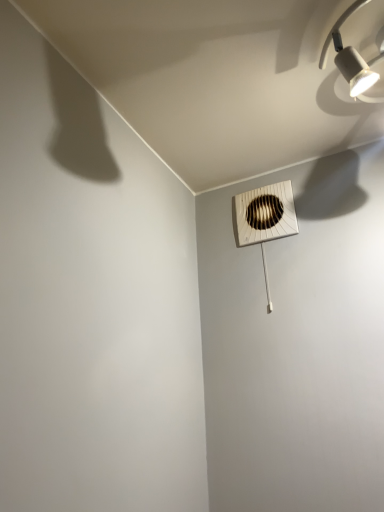
This screenshot has height=512, width=384. Describe the element at coordinates (265, 219) in the screenshot. I see `white plastic vent at center` at that location.

In order to click on white plastic vent at center in this screenshot , I will do `click(265, 219)`.

Find the location of a particular element. The width and height of the screenshot is (384, 512). white plastic vent at center is located at coordinates (265, 219).